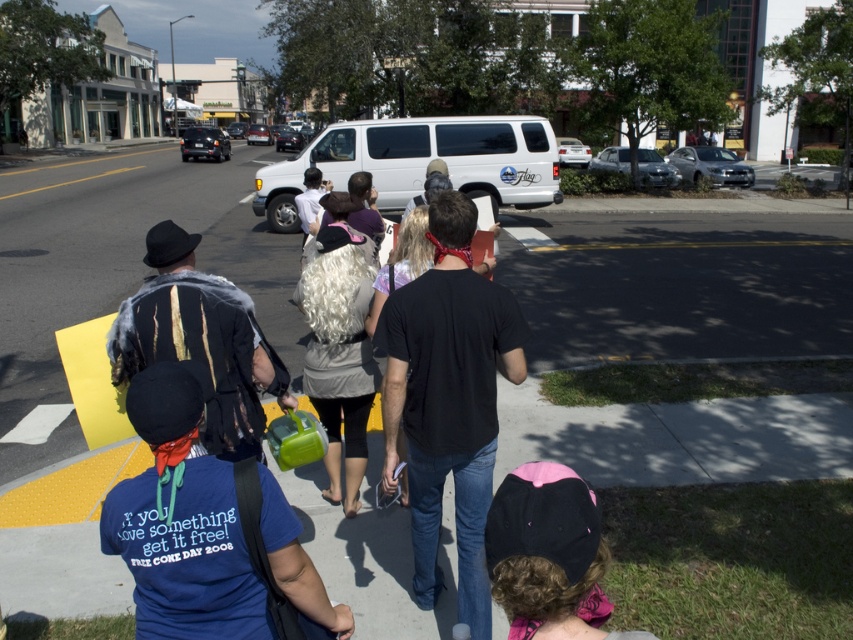
Can you confirm if silver metallic sedan at center is taller than shiny black sedan at upper left?

No.

Is silver metallic sedan at center thinner than shiny black sedan at upper left?

Yes.

Does point (592, 163) lie in front of point (200, 156)?

Yes, it is in front of point (200, 156).

The width and height of the screenshot is (853, 640). In order to click on silver metallic sedan at center in this screenshot , I will do `click(654, 170)`.

Is point (724, 154) behind point (575, 141)?

No, (724, 154) is in front of (575, 141).

Does silver metallic sedan at right have a greater width compared to white matte sedan at center?

Indeed, silver metallic sedan at right has a greater width compared to white matte sedan at center.

Is point (721, 176) farther from viewer compared to point (563, 145)?

No.

Find the location of a particular element. The image size is (853, 640). silver metallic sedan at right is located at coordinates (711, 164).

Who is shorter, black fabric cap at lower right or silver metallic sedan at right?

black fabric cap at lower right is shorter.

The image size is (853, 640). Describe the element at coordinates (547, 554) in the screenshot. I see `black fabric cap at lower right` at that location.

This screenshot has height=640, width=853. I want to click on black fabric cap at lower right, so click(547, 554).